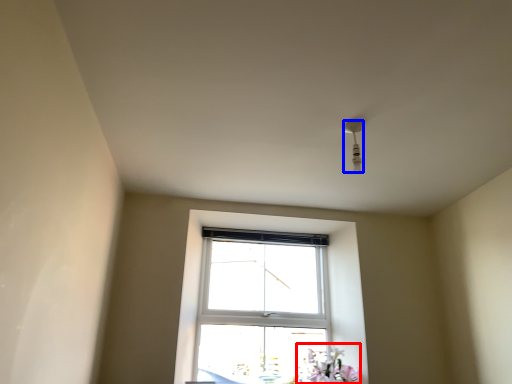
Question: Which point is further to the camera, flower (highlighted by a red box) or light fixture (highlighted by a blue box)?

Choices:
 (A) flower
 (B) light fixture

Answer: (A)